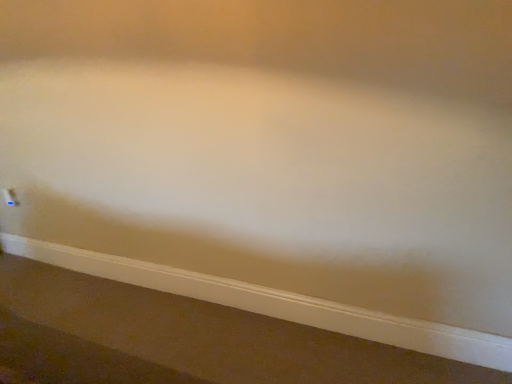
Locate an element on the screen. This screenshot has width=512, height=384. white plastic electric outlet at lower left is located at coordinates (10, 197).

What do you see at coordinates (10, 197) in the screenshot?
I see `white plastic electric outlet at lower left` at bounding box center [10, 197].

This screenshot has height=384, width=512. What do you see at coordinates (278, 304) in the screenshot? I see `white smooth baseboard at lower center` at bounding box center [278, 304].

Where is `white smooth baseboard at lower center`? This screenshot has height=384, width=512. white smooth baseboard at lower center is located at coordinates (278, 304).

Where is `white plastic electric outlet at lower left`? The image size is (512, 384). white plastic electric outlet at lower left is located at coordinates (10, 197).

Considering the positions of objects white plastic electric outlet at lower left and white smooth baseboard at lower center in the image provided, who is more to the right, white plastic electric outlet at lower left or white smooth baseboard at lower center?

From the viewer's perspective, white smooth baseboard at lower center appears more on the right side.

Considering the relative positions of white plastic electric outlet at lower left and white smooth baseboard at lower center in the image provided, is white plastic electric outlet at lower left in front of white smooth baseboard at lower center?

No, white plastic electric outlet at lower left is behind white smooth baseboard at lower center.

Is point (11, 202) behind point (321, 318)?

Yes, it is.

From the image's perspective, which is below, white plastic electric outlet at lower left or white smooth baseboard at lower center?

white smooth baseboard at lower center, from the image's perspective.

From a real-world perspective, is white plastic electric outlet at lower left located beneath white smooth baseboard at lower center?

Incorrect, from a real-world perspective, white plastic electric outlet at lower left is higher than white smooth baseboard at lower center.

Does white plastic electric outlet at lower left have a lesser width compared to white smooth baseboard at lower center?

Yes.

Between white plastic electric outlet at lower left and white smooth baseboard at lower center, which one has less height?

With less height is white plastic electric outlet at lower left.

Considering the sizes of objects white plastic electric outlet at lower left and white smooth baseboard at lower center in the image provided, who is smaller, white plastic electric outlet at lower left or white smooth baseboard at lower center?

Smaller between the two is white plastic electric outlet at lower left.

Is white plastic electric outlet at lower left completely or partially outside of white smooth baseboard at lower center?

That's correct, white plastic electric outlet at lower left is outside of white smooth baseboard at lower center.

Is white plastic electric outlet at lower left next to white smooth baseboard at lower center and touching it?

There is a gap between white plastic electric outlet at lower left and white smooth baseboard at lower center.

Is white plastic electric outlet at lower left positioned with its back to white smooth baseboard at lower center?

No, white plastic electric outlet at lower left is not facing the opposite direction of white smooth baseboard at lower center.

How far apart are white plastic electric outlet at lower left and white smooth baseboard at lower center?

white plastic electric outlet at lower left and white smooth baseboard at lower center are 4.40 feet apart from each other.

What are the coordinates of `electric outlet above the white smooth baseboard at lower center (from the image's perspective)` in the screenshot? It's located at (x=10, y=197).

Which is more to the left, white smooth baseboard at lower center or white plastic electric outlet at lower left?

Positioned to the left is white plastic electric outlet at lower left.

Is the depth of white smooth baseboard at lower center greater than that of white plastic electric outlet at lower left?

No, it is not.

Is point (336, 330) closer or farther from the camera than point (13, 195)?

Point (336, 330).

From the image's perspective, between white smooth baseboard at lower center and white plastic electric outlet at lower left, who is located below?

From the image's view, white smooth baseboard at lower center is below.

From a real-world perspective, is white smooth baseboard at lower center beneath white plastic electric outlet at lower left?

Yes, from a real-world perspective, white smooth baseboard at lower center is under white plastic electric outlet at lower left.

Can you confirm if white smooth baseboard at lower center is wider than white plastic electric outlet at lower left?

Yes.

Is white smooth baseboard at lower center taller or shorter than white plastic electric outlet at lower left?

Clearly, white smooth baseboard at lower center is taller compared to white plastic electric outlet at lower left.

Looking at this image, considering the sizes of white smooth baseboard at lower center and white plastic electric outlet at lower left in the image, is white smooth baseboard at lower center bigger or smaller than white plastic electric outlet at lower left?

Considering their sizes, white smooth baseboard at lower center takes up more space than white plastic electric outlet at lower left.

Does white smooth baseboard at lower center contain white plastic electric outlet at lower left?

No, white plastic electric outlet at lower left is not a part of white smooth baseboard at lower center.

Is white smooth baseboard at lower center next to white plastic electric outlet at lower left?

No, white smooth baseboard at lower center is not touching white plastic electric outlet at lower left.

Is white plastic electric outlet at lower left at the back of white smooth baseboard at lower center?

No.

There is a white smooth baseboard at lower center. Where is `electric outlet above it (from a real-world perspective)`? This screenshot has height=384, width=512. electric outlet above it (from a real-world perspective) is located at coordinates [10, 197].

Locate an element on the screen. The height and width of the screenshot is (384, 512). electric outlet lying on the left of white smooth baseboard at lower center is located at coordinates (10, 197).

This screenshot has width=512, height=384. What are the coordinates of `ledge on the right of white plastic electric outlet at lower left` in the screenshot? It's located at (278, 304).